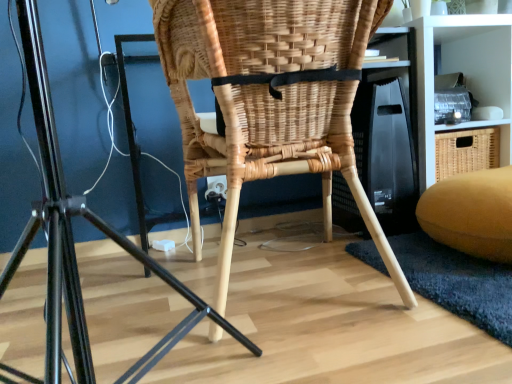
The height and width of the screenshot is (384, 512). Describe the element at coordinates (471, 213) in the screenshot. I see `velvet yellow bean bag at lower right` at that location.

In order to click on velvet yellow bean bag at lower right in this screenshot , I will do `click(471, 213)`.

Describe the element at coordinates (270, 101) in the screenshot. I see `natural woven chair at center` at that location.

This screenshot has width=512, height=384. I want to click on natural wicker chair at center, so click(x=73, y=243).

Is white matte shelf at upper right spatially inside natural wicker chair at center, or outside of it?

white matte shelf at upper right is not enclosed by natural wicker chair at center.

Is white matte shelf at upper right facing towards natural wicker chair at center?

No, white matte shelf at upper right is not facing towards natural wicker chair at center.

Between white matte shelf at upper right and natural wicker chair at center, which one is positioned in front?

natural wicker chair at center is more forward.

Considering the sizes of objects white matte shelf at upper right and natural wicker chair at center in the image provided, who is smaller, white matte shelf at upper right or natural wicker chair at center?

Smaller between the two is white matte shelf at upper right.

Considering the sizes of objects velvet yellow bean bag at lower right and white matte shelf at upper right in the image provided, who is wider, velvet yellow bean bag at lower right or white matte shelf at upper right?

Wider between the two is velvet yellow bean bag at lower right.

Consider the image. Can you confirm if velvet yellow bean bag at lower right is bigger than white matte shelf at upper right?

No.

From a real-world perspective, who is located higher, velvet yellow bean bag at lower right or white matte shelf at upper right?

white matte shelf at upper right.

Is velvet yellow bean bag at lower right in front of or behind white matte shelf at upper right in the image?

Clearly, velvet yellow bean bag at lower right is in front of white matte shelf at upper right.

From the image's perspective, between natural wicker chair at center and natural woven chair at center, who is located below?

From the image's view, natural wicker chair at center is below.

Are natural wicker chair at center and natural woven chair at center far apart?

No, natural wicker chair at center is in close proximity to natural woven chair at center.

Can you confirm if natural wicker chair at center is smaller than natural woven chair at center?

Correct, natural wicker chair at center occupies less space than natural woven chair at center.

Does natural wicker chair at center have a greater width compared to natural woven chair at center?

No.

Is natural woven chair at center inside white matte shelf at upper right?

Definitely not — natural woven chair at center is not inside white matte shelf at upper right.

From the image's perspective, is white matte shelf at upper right positioned above or below natural woven chair at center?

white matte shelf at upper right is situated higher than natural woven chair at center in the image.

Which of these two, natural wicker chair at center or velvet yellow bean bag at lower right, is thinner?

Thinner between the two is velvet yellow bean bag at lower right.

Can you confirm if natural wicker chair at center is positioned to the left of velvet yellow bean bag at lower right?

Correct, you'll find natural wicker chair at center to the left of velvet yellow bean bag at lower right.

Between natural wicker chair at center and velvet yellow bean bag at lower right, which one has less height?

velvet yellow bean bag at lower right.

Are natural wicker chair at center and velvet yellow bean bag at lower right making contact?

No, natural wicker chair at center is not touching velvet yellow bean bag at lower right.

Is white matte shelf at upper right inside the boundaries of velvet yellow bean bag at lower right, or outside?

white matte shelf at upper right is not enclosed by velvet yellow bean bag at lower right.

Considering the sizes of white matte shelf at upper right and velvet yellow bean bag at lower right in the image, is white matte shelf at upper right wider or thinner than velvet yellow bean bag at lower right?

white matte shelf at upper right is thinner than velvet yellow bean bag at lower right.

Is white matte shelf at upper right in front of velvet yellow bean bag at lower right?

No, the depth of white matte shelf at upper right is greater than that of velvet yellow bean bag at lower right.

Is there a large distance between white matte shelf at upper right and velvet yellow bean bag at lower right?

No, white matte shelf at upper right is not far away from velvet yellow bean bag at lower right.

From the image's perspective, would you say velvet yellow bean bag at lower right is shown under natural wicker chair at center?

Yes, from the image's perspective, velvet yellow bean bag at lower right is below natural wicker chair at center.

In the image, is velvet yellow bean bag at lower right on the left side or the right side of natural wicker chair at center?

velvet yellow bean bag at lower right is positioned on natural wicker chair at center's right side.

From a real-world perspective, who is located lower, velvet yellow bean bag at lower right or natural wicker chair at center?

velvet yellow bean bag at lower right.

Considering the sizes of velvet yellow bean bag at lower right and natural wicker chair at center in the image, is velvet yellow bean bag at lower right wider or thinner than natural wicker chair at center?

velvet yellow bean bag at lower right is thinner than natural wicker chair at center.

The height and width of the screenshot is (384, 512). Find the location of `furniture in front of the white matte shelf at upper right`. furniture in front of the white matte shelf at upper right is located at coordinates (73, 243).

The height and width of the screenshot is (384, 512). What are the coordinates of `shelf behind the velvet yellow bean bag at lower right` in the screenshot? It's located at (464, 76).

When comparing their distances from natural woven chair at center, does natural wicker chair at center or white matte shelf at upper right seem further?

white matte shelf at upper right.

Consider the image. Estimate the real-world distances between objects in this image. Which object is closer to white matte shelf at upper right, velvet yellow bean bag at lower right or natural wicker chair at center?

velvet yellow bean bag at lower right lies closer to white matte shelf at upper right than the other object.

When comparing their distances from velvet yellow bean bag at lower right, does white matte shelf at upper right or natural wicker chair at center seem closer?

white matte shelf at upper right is positioned closer to the anchor velvet yellow bean bag at lower right.

Estimate the real-world distances between objects in this image. Which object is closer to white matte shelf at upper right, natural wicker chair at center or velvet yellow bean bag at lower right?

velvet yellow bean bag at lower right is positioned closer to the anchor white matte shelf at upper right.

Looking at the image, which one is located further to velvet yellow bean bag at lower right, white matte shelf at upper right or natural woven chair at center?

Based on the image, natural woven chair at center appears to be further to velvet yellow bean bag at lower right.

From the image, which object appears to be farther from natural wicker chair at center, natural woven chair at center or white matte shelf at upper right?

white matte shelf at upper right is positioned further to the anchor natural wicker chair at center.

Based on their spatial positions, is velvet yellow bean bag at lower right or natural wicker chair at center closer to natural woven chair at center?

natural wicker chair at center lies closer to natural woven chair at center than the other object.

When comparing their distances from velvet yellow bean bag at lower right, does natural wicker chair at center or white matte shelf at upper right seem closer?

Based on the image, white matte shelf at upper right appears to be nearer to velvet yellow bean bag at lower right.

This screenshot has width=512, height=384. What are the coordinates of `bean bag chair positioned between natural wicker chair at center and white matte shelf at upper right from near to far` in the screenshot? It's located at (471, 213).

Identify the location of chair situated between natural wicker chair at center and velvet yellow bean bag at lower right from left to right. The height and width of the screenshot is (384, 512). (270, 101).

Identify the location of chair between natural wicker chair at center and white matte shelf at upper right along the z-axis. This screenshot has width=512, height=384. (270, 101).

Find the location of a particular element. bean bag chair situated between natural woven chair at center and white matte shelf at upper right from left to right is located at coordinates (471, 213).